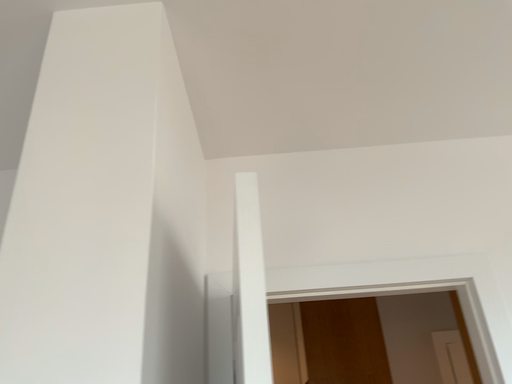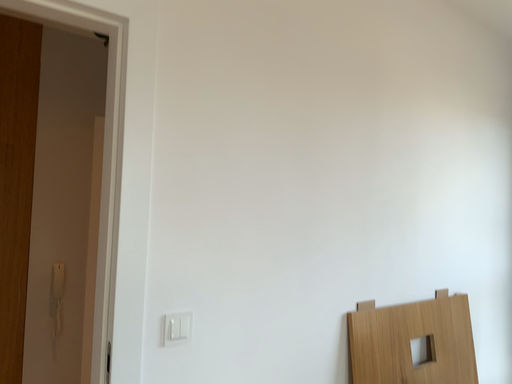
Question: Which way did the camera rotate in the video?

Choices:
 (A) rotated right
 (B) rotated left

Answer: (A)